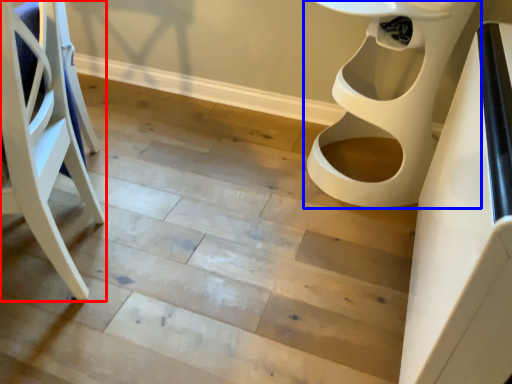
Question: Which object appears farthest to the camera in this image, furniture (highlighted by a red box) or toilet (highlighted by a blue box)?

Choices:
 (A) furniture
 (B) toilet

Answer: (B)